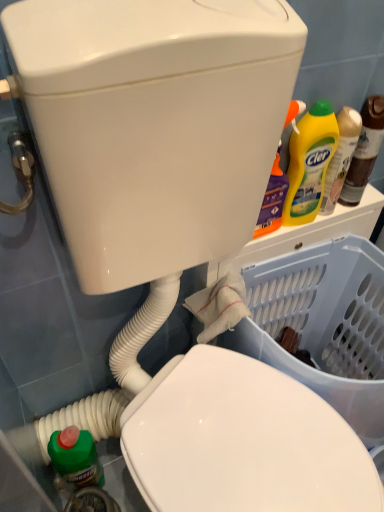
Question: Is yellow liquid detergent at upper right, which is the 1th bottle from right to left, inside the boundaries of yellow plastic bottle at upper right, the 2th bottle from the right, or outside?

Choices:
 (A) outside
 (B) inside

Answer: (A)

Question: From their relative heights in the image, would you say yellow liquid detergent at upper right, which is the 1th bottle from right to left, is taller or shorter than yellow plastic bottle at upper right, the 1th bottle when ordered from left to right?

Choices:
 (A) tall
 (B) short

Answer: (A)

Question: Which is farther from the transparent plastic basket at lower right?

Choices:
 (A) yellow liquid detergent at upper right, which is the second bottle from left to right
 (B) yellow plastic bottle at upper right, the 2th bottle from the right
 (C) yellow matte bottle at upper right

Answer: (A)

Question: Which is nearer to the yellow liquid detergent at upper right, which is the 1th bottle from right to left?

Choices:
 (A) transparent plastic basket at lower right
 (B) yellow plastic bottle at upper right, the 2th bottle from the right
 (C) yellow matte bottle at upper right

Answer: (B)